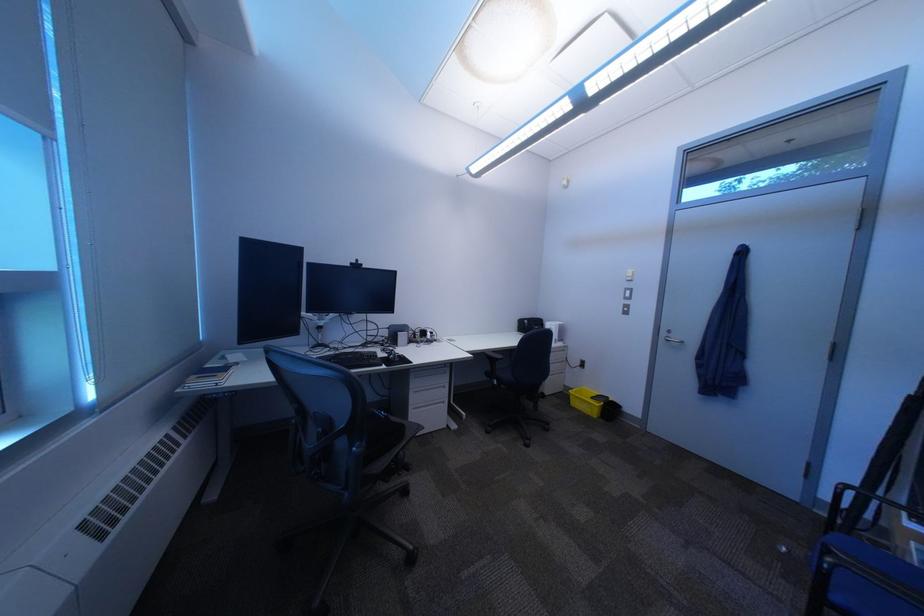
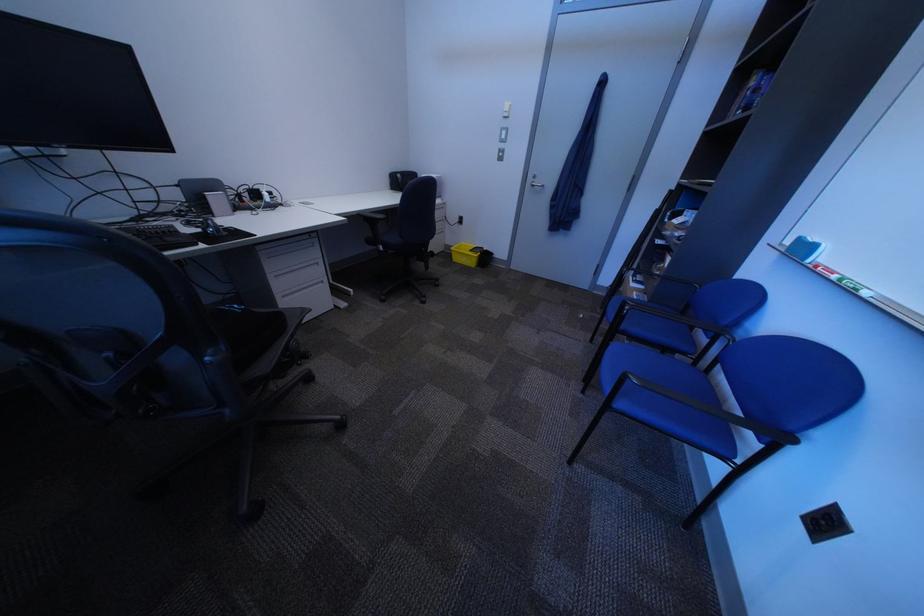
In the second image, find the point that corresponds to point 805,554 in the first image.

(599, 318)